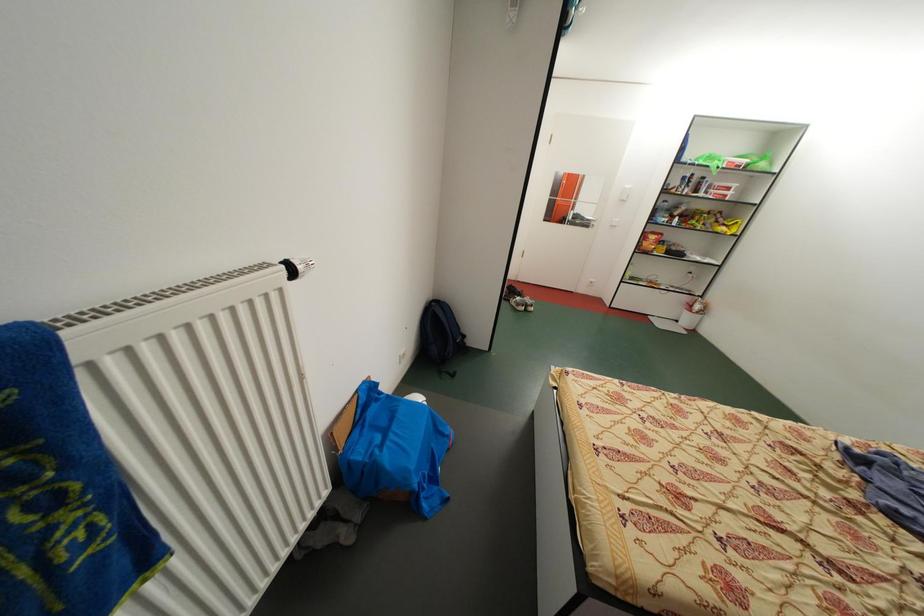
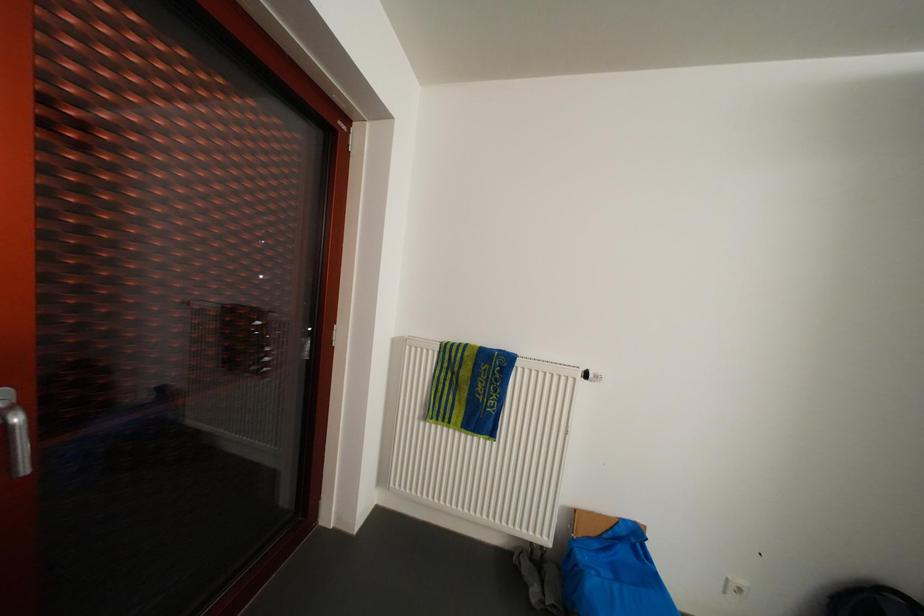
Question: The first image is from the beginning of the video and the second image is from the end. How did the camera likely rotate when shooting the video?

Choices:
 (A) Left
 (B) Right
 (C) Up
 (D) Down

Answer: (A)